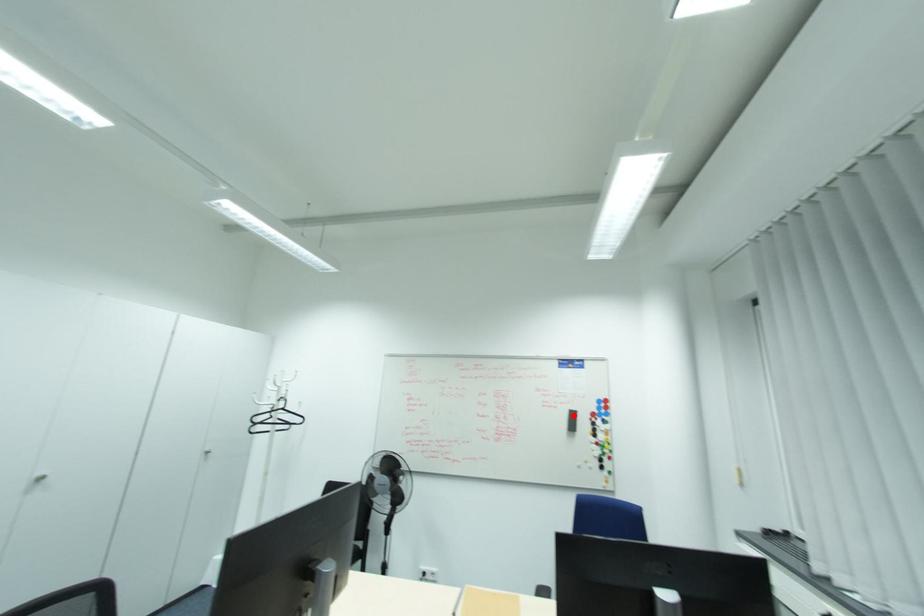
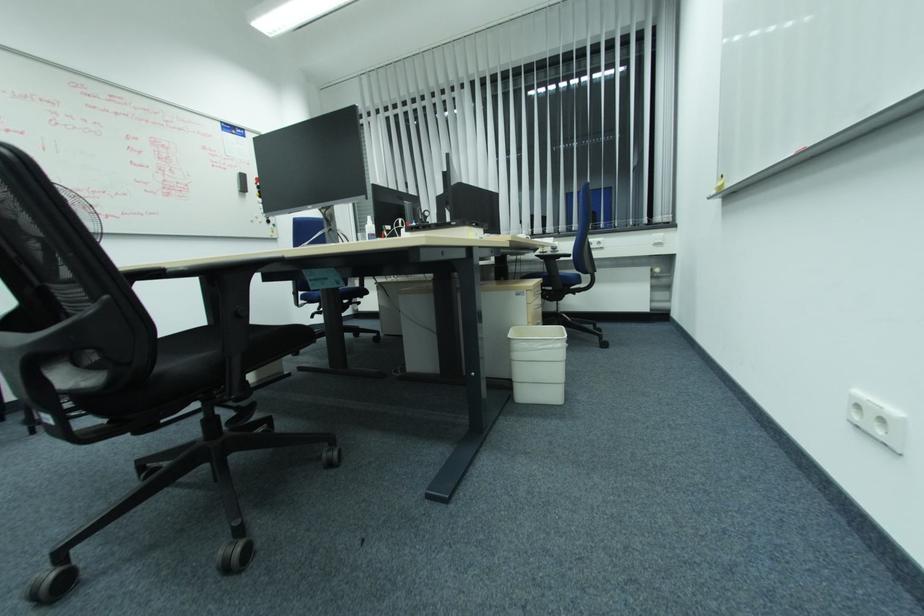
Question: I am providing you with two images of the same scene from different viewpoints. In image1, a red point is highlighted. Considering the same 3D point in image2, which of the following is correct?

Choices:
 (A) It is closer
 (B) It is farther

Answer: (A)